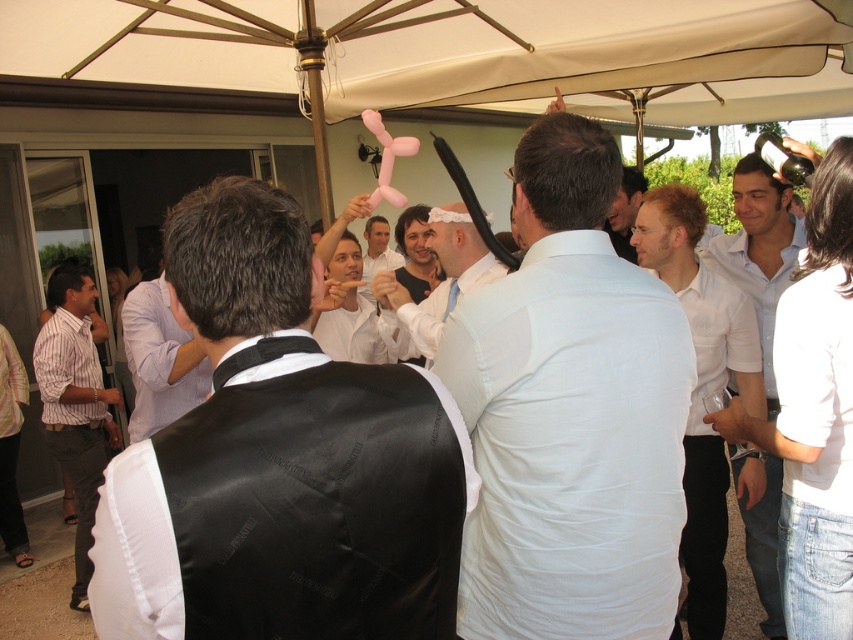
Question: Which point is closer to the camera taking this photo?

Choices:
 (A) (381, 218)
 (B) (724, 340)
 (C) (451, 228)
 (D) (436, 548)

Answer: (D)

Question: Is striped shirt at left wider than white shirt at center?

Choices:
 (A) yes
 (B) no

Answer: (A)

Question: Is white smooth shirt at center positioned in front of white shirt at center?

Choices:
 (A) yes
 (B) no

Answer: (A)

Question: Where is white smooth shirt at center located in relation to striped shirt at left in the image?

Choices:
 (A) below
 (B) above

Answer: (B)

Question: Which point is closer to the camera?

Choices:
 (A) (154, 580)
 (B) (486, 396)
 (C) (766, 392)

Answer: (A)

Question: Which is farther from the white cotton shirt at center?

Choices:
 (A) black satin vest at center
 (B) light brown hair at center

Answer: (A)